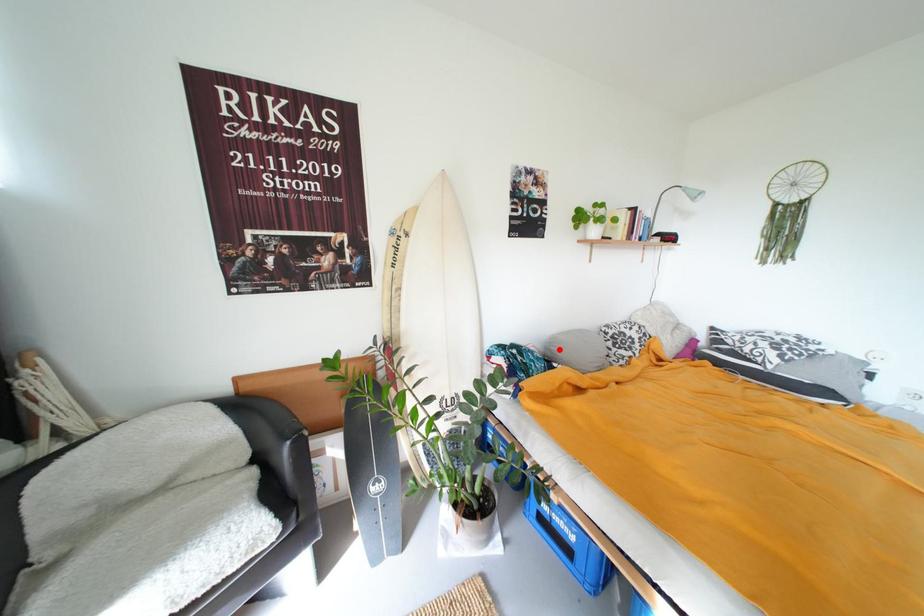
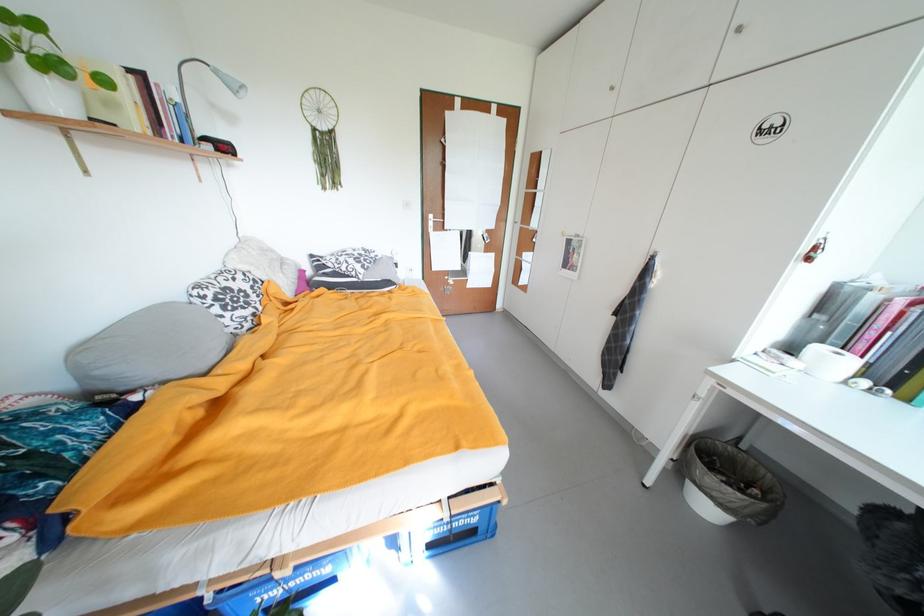
The point at the highlighted location is marked in the first image. Where is the corresponding point in the second image?

(105, 374)